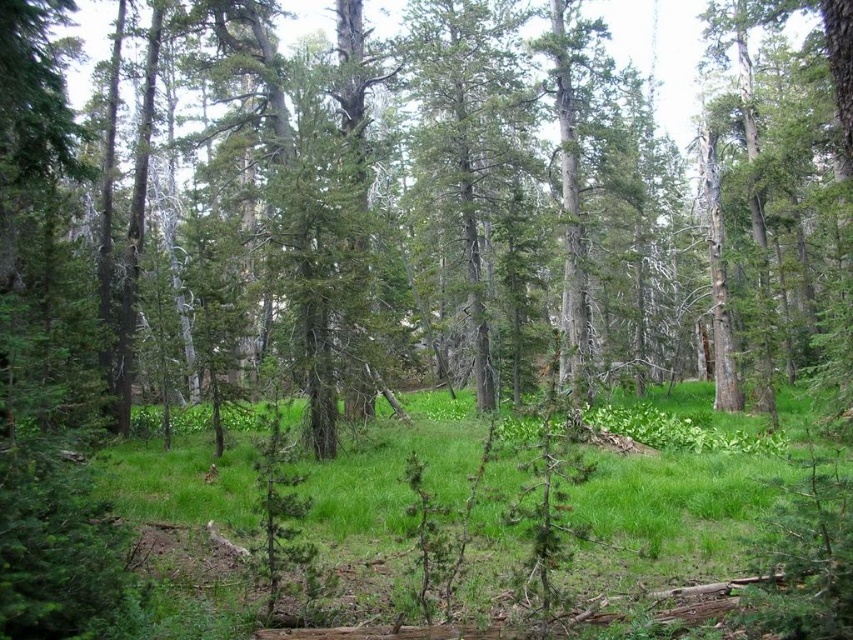
Question: Which of the following is the closest to the observer?

Choices:
 (A) green grassy area at center
 (B) green leafy tree at center

Answer: (B)

Question: Is green leafy tree at center positioned in front of green grassy area at center?

Choices:
 (A) yes
 (B) no

Answer: (A)

Question: Does green leafy tree at center appear on the right side of green grassy area at center?

Choices:
 (A) yes
 (B) no

Answer: (B)

Question: Is green leafy tree at center below green grassy area at center?

Choices:
 (A) yes
 (B) no

Answer: (B)